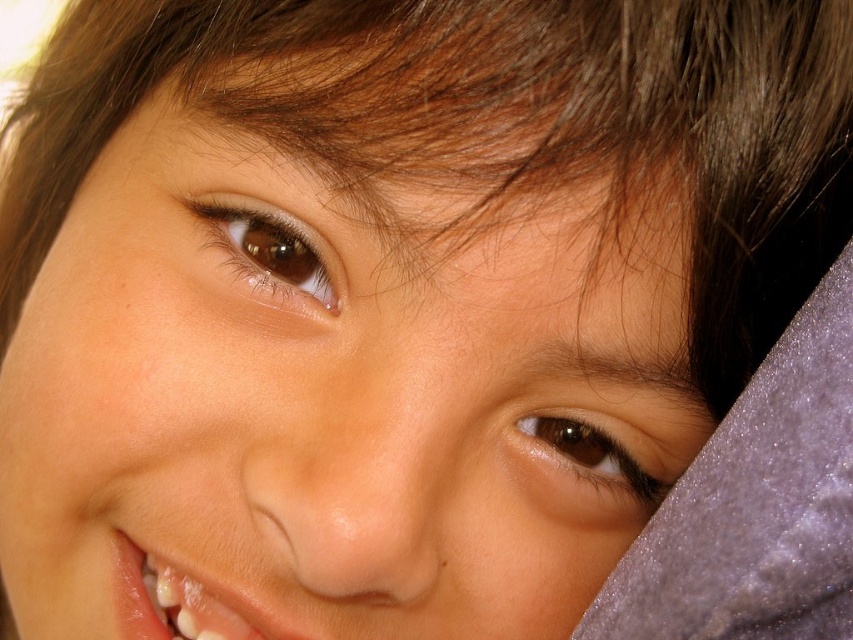
Who is more forward, (260, 218) or (637, 483)?

Point (260, 218) is more forward.

Who is higher up, brown shiny eye at upper center or brown shiny eye at lower right?

Positioned higher is brown shiny eye at upper center.

Is point (247, 211) less distant than point (535, 435)?

Yes, point (247, 211) is closer to viewer.

Locate an element on the screen. The width and height of the screenshot is (853, 640). brown shiny eye at upper center is located at coordinates (270, 248).